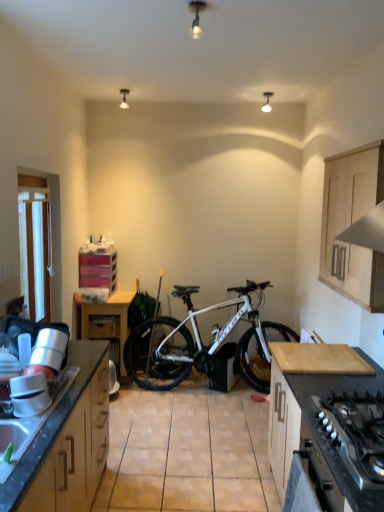
Question: Can you confirm if pink plastic drawers at center left, the 1th cabinetry viewed from the left, is shorter than light wood cabinet at upper right, the fourth cabinetry from the left?

Choices:
 (A) no
 (B) yes

Answer: (B)

Question: From a real-world perspective, is pink plastic drawers at center left, marked as the 4th cabinetry in a right-to-left arrangement, physically below light wood cabinet at upper right, the 2th cabinetry in the front-to-back sequence?

Choices:
 (A) no
 (B) yes

Answer: (B)

Question: Considering the relative positions of pink plastic drawers at center left, which is the 4th cabinetry in front-to-back order, and light wood cabinet at upper right, which is the first cabinetry from right to left, in the image provided, is pink plastic drawers at center left, which is the 4th cabinetry in front-to-back order, to the right of light wood cabinet at upper right, which is the first cabinetry from right to left, from the viewer's perspective?

Choices:
 (A) no
 (B) yes

Answer: (A)

Question: Is pink plastic drawers at center left, the 1th cabinetry viewed from the left, directly adjacent to light wood cabinet at upper right, which is the first cabinetry from right to left?

Choices:
 (A) no
 (B) yes

Answer: (A)

Question: Does pink plastic drawers at center left, which is the 4th cabinetry in front-to-back order, have a larger size compared to light wood cabinet at upper right, the fourth cabinetry from the left?

Choices:
 (A) yes
 (B) no

Answer: (B)

Question: Considering the relative positions of light wood countertop at lower right, positioned as the second cabinetry in right-to-left order, and matte plastic drawer at center in the image provided, is light wood countertop at lower right, positioned as the second cabinetry in right-to-left order, to the left or to the right of matte plastic drawer at center?

Choices:
 (A) right
 (B) left

Answer: (A)

Question: Does point (324, 365) appear closer or farther from the camera than point (112, 325)?

Choices:
 (A) closer
 (B) farther

Answer: (A)

Question: Based on their sizes in the image, would you say light wood countertop at lower right, the third cabinetry viewed from the left, is bigger or smaller than matte plastic drawer at center?

Choices:
 (A) small
 (B) big

Answer: (B)

Question: Is light wood countertop at lower right, the third cabinetry viewed from the left, in front of or behind matte plastic drawer at center in the image?

Choices:
 (A) front
 (B) behind

Answer: (A)

Question: Is point (367, 438) positioned closer to the camera than point (92, 315)?

Choices:
 (A) closer
 (B) farther

Answer: (A)

Question: From a real-world perspective, is black matte gas stove at lower right above or below matte plastic drawer at center?

Choices:
 (A) above
 (B) below

Answer: (A)

Question: Considering the positions of black matte gas stove at lower right and matte plastic drawer at center in the image, is black matte gas stove at lower right bigger or smaller than matte plastic drawer at center?

Choices:
 (A) small
 (B) big

Answer: (A)

Question: From their relative heights in the image, would you say black matte gas stove at lower right is taller or shorter than matte plastic drawer at center?

Choices:
 (A) tall
 (B) short

Answer: (B)

Question: In terms of width, does white fabric at left look wider or thinner when compared to pink plastic drawers at center left, which is the 4th cabinetry in front-to-back order?

Choices:
 (A) thin
 (B) wide

Answer: (A)

Question: Looking at the image, does white fabric at left seem bigger or smaller compared to pink plastic drawers at center left, the 1th cabinetry viewed from the back?

Choices:
 (A) big
 (B) small

Answer: (B)